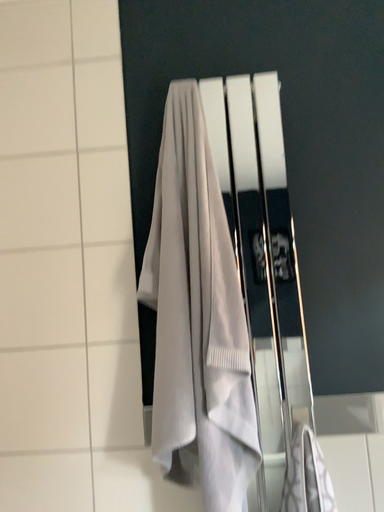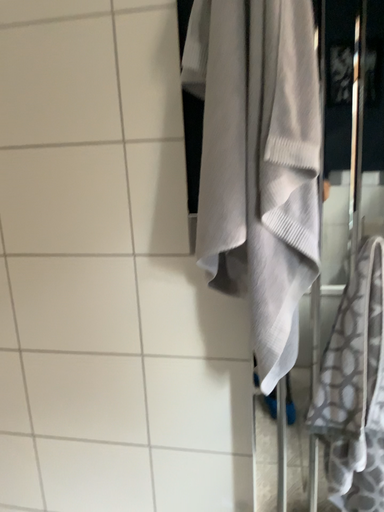
Question: Which way did the camera rotate in the video?

Choices:
 (A) rotated downward
 (B) rotated upward

Answer: (A)